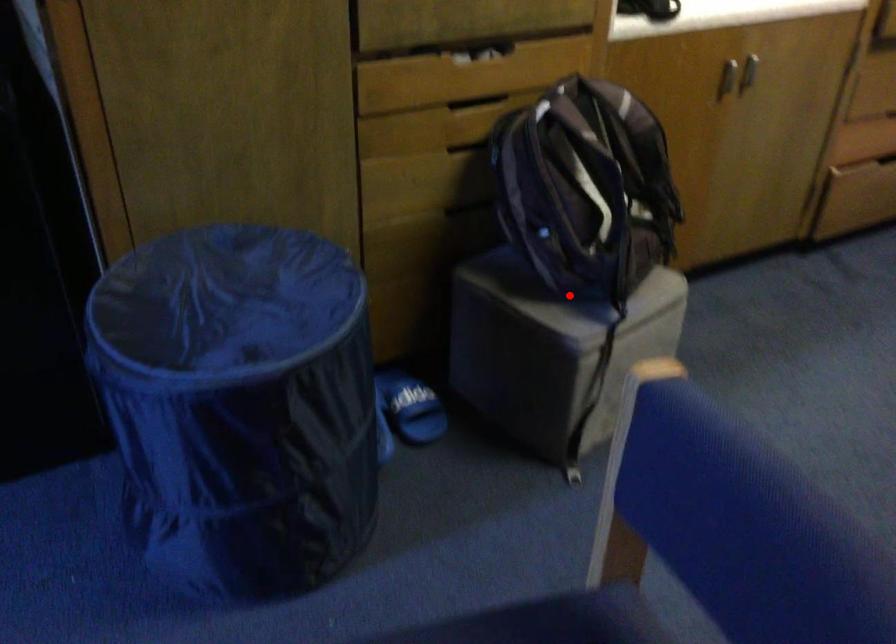
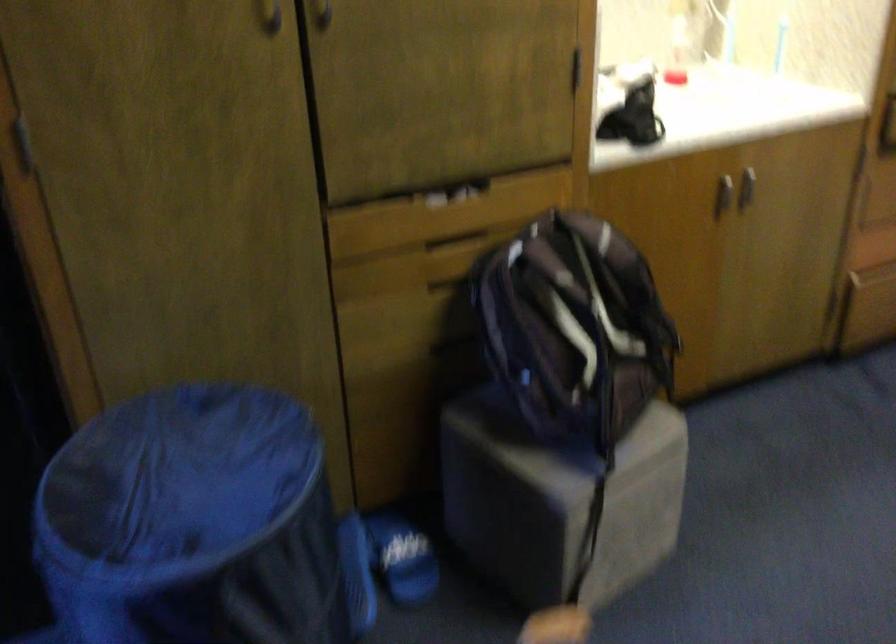
Where in the second image is the point corresponding to the highlighted location from the first image?

(556, 442)